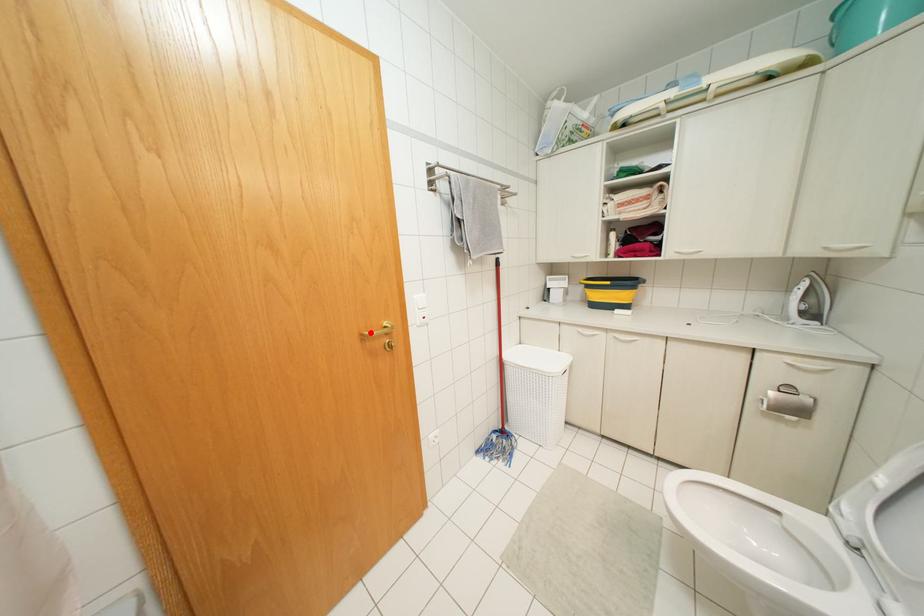
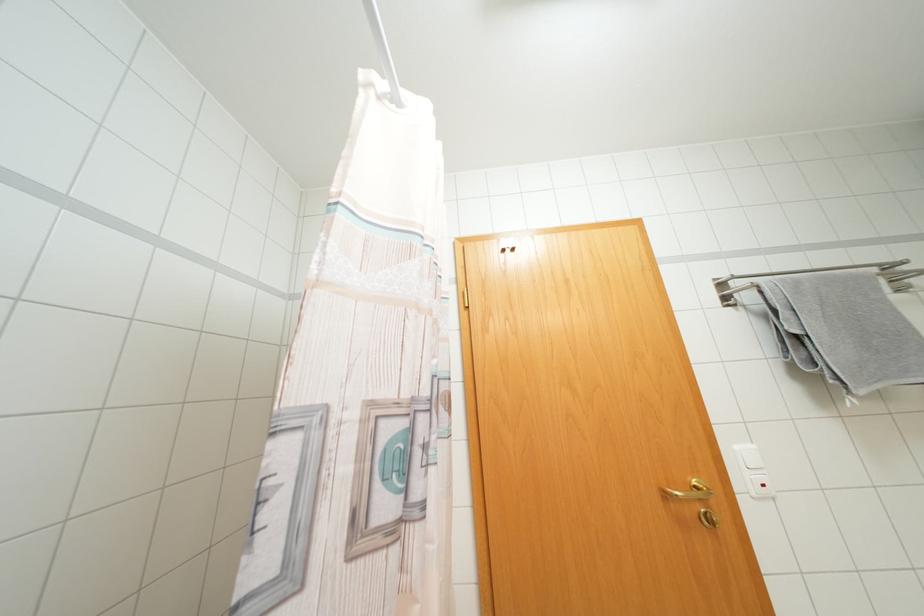
Where in the second image is the point corresponding to the highlighted location from the first image?

(676, 493)